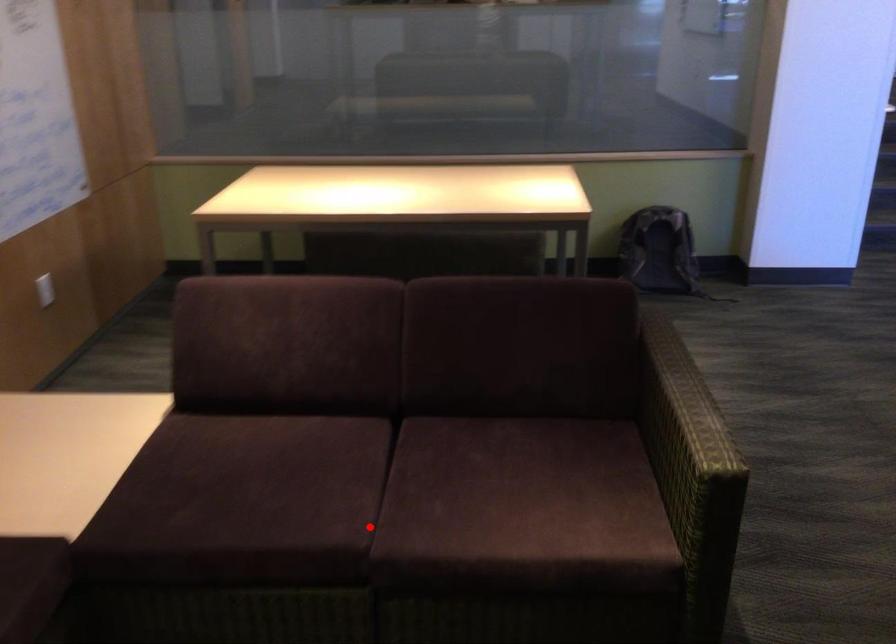
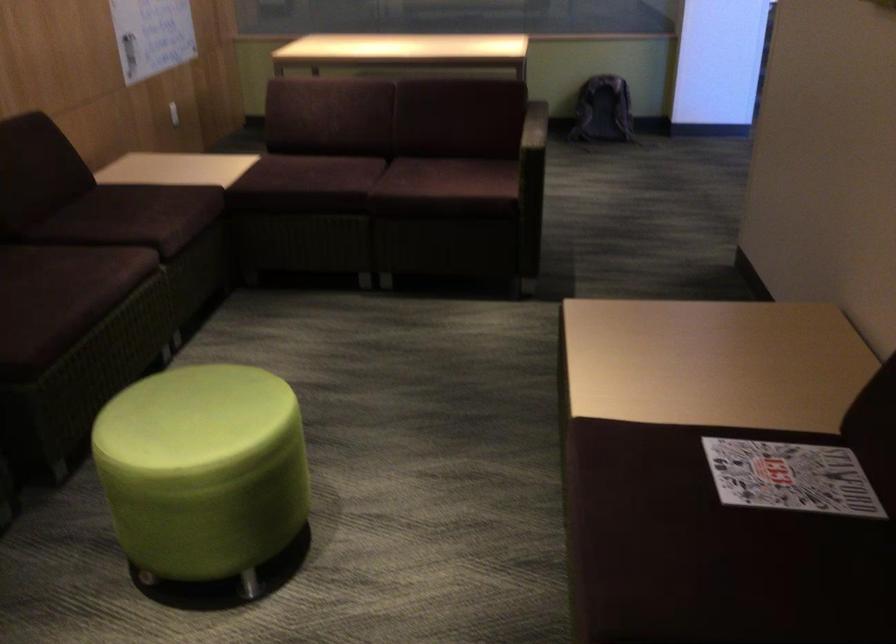
Question: I am providing you with two images of the same scene from different viewpoints. In image1, a red point is highlighted. Considering the same 3D point in image2, which of the following is correct?

Choices:
 (A) It is closer
 (B) It is farther

Answer: (B)